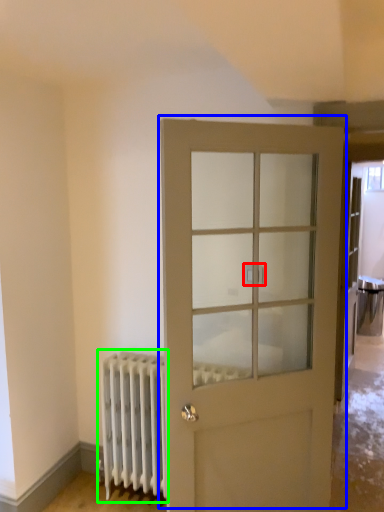
Question: Based on their relative distances, which object is nearer to door handle (highlighted by a red box)? Choose from door (highlighted by a blue box) and radiator (highlighted by a green box).

Choices:
 (A) door
 (B) radiator

Answer: (A)